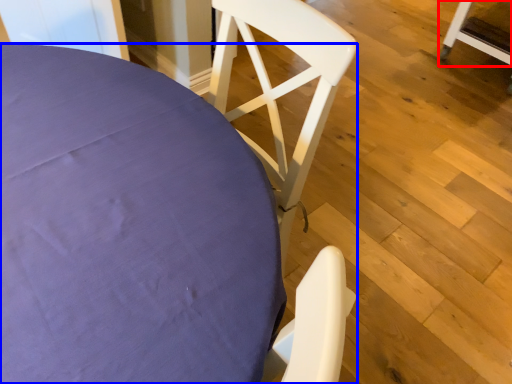
Question: Which object appears farthest to the camera in this image, chair (highlighted by a red box) or chair (highlighted by a blue box)?

Choices:
 (A) chair
 (B) chair

Answer: (A)